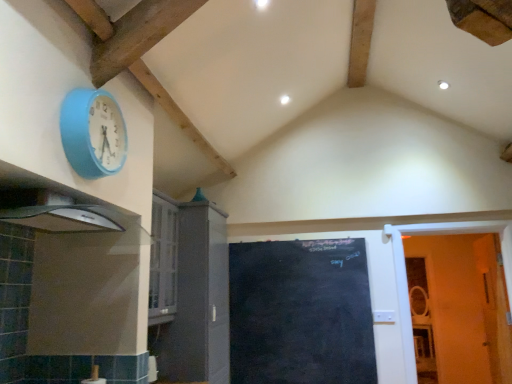
This screenshot has height=384, width=512. What do you see at coordinates (93, 133) in the screenshot? I see `blue rubber wall clock at upper left` at bounding box center [93, 133].

Where is `blue rubber wall clock at upper left`? The height and width of the screenshot is (384, 512). blue rubber wall clock at upper left is located at coordinates (93, 133).

Locate an element on the screen. Image resolution: width=512 pixels, height=384 pixels. white wooden door at right, acting as the second door starting from the left is located at coordinates (406, 275).

Identify the location of matte gray cabinet at center-left. (193, 293).

Locate an element on the screen. The width and height of the screenshot is (512, 384). black chalkboard at center, the 1th door from the left is located at coordinates (300, 313).

The width and height of the screenshot is (512, 384). Find the location of `blue rubber wall clock at upper left`. blue rubber wall clock at upper left is located at coordinates (x=93, y=133).

Considering the positions of objects black chalkboard at center, the 1th door from the left, and matte gray cabinet at center-left in the image provided, who is more to the right, black chalkboard at center, the 1th door from the left, or matte gray cabinet at center-left?

black chalkboard at center, the 1th door from the left.

Considering the sizes of black chalkboard at center, the 1th door from the left, and matte gray cabinet at center-left in the image, is black chalkboard at center, the 1th door from the left, bigger or smaller than matte gray cabinet at center-left?

black chalkboard at center, the 1th door from the left, is smaller than matte gray cabinet at center-left.

Considering their positions, is black chalkboard at center, positioned as the second door in right-to-left order, located in front of or behind matte gray cabinet at center-left?

Clearly, black chalkboard at center, positioned as the second door in right-to-left order, is behind matte gray cabinet at center-left.

From a real-world perspective, does black chalkboard at center, the 1th door from the left, sit lower than matte gray cabinet at center-left?

Indeed, from a real-world perspective, black chalkboard at center, the 1th door from the left, is positioned beneath matte gray cabinet at center-left.

Considering the sizes of objects blue rubber wall clock at upper left and white wooden door at right, acting as the second door starting from the left, in the image provided, who is thinner, blue rubber wall clock at upper left or white wooden door at right, acting as the second door starting from the left,?

Thinner between the two is blue rubber wall clock at upper left.

Is blue rubber wall clock at upper left not near white wooden door at right, acting as the second door starting from the left?

Indeed, blue rubber wall clock at upper left is not near white wooden door at right, acting as the second door starting from the left.

Measure the distance from blue rubber wall clock at upper left to white wooden door at right, acting as the second door starting from the left.

The distance of blue rubber wall clock at upper left from white wooden door at right, acting as the second door starting from the left, is 9.09 feet.

Would you say black chalkboard at center, positioned as the second door in right-to-left order, is part of matte gray cabinet at center-left's contents?

No, black chalkboard at center, positioned as the second door in right-to-left order, is not inside matte gray cabinet at center-left.

I want to click on door that is the 1st object to the right of the matte gray cabinet at center-left, starting at the anchor, so click(300, 313).

From the image's perspective, between matte gray cabinet at center-left and black chalkboard at center, the 1th door from the left, who is located below?

black chalkboard at center, the 1th door from the left, is shown below in the image.

Does matte gray cabinet at center-left turn towards white wooden door at right, which is the 1th door from right to left?

Yes.

Does matte gray cabinet at center-left have a lesser width compared to white wooden door at right, which is the 1th door from right to left?

Incorrect, the width of matte gray cabinet at center-left is not less than that of white wooden door at right, which is the 1th door from right to left.

Does matte gray cabinet at center-left have a greater height compared to white wooden door at right, which is the 1th door from right to left?

Yes, matte gray cabinet at center-left is taller than white wooden door at right, which is the 1th door from right to left.

Is black chalkboard at center, positioned as the second door in right-to-left order, positioned beyond the bounds of blue rubber wall clock at upper left?

black chalkboard at center, positioned as the second door in right-to-left order, lies outside blue rubber wall clock at upper left's area.

In the scene shown: Who is smaller, black chalkboard at center, positioned as the second door in right-to-left order, or blue rubber wall clock at upper left?

blue rubber wall clock at upper left.

Does black chalkboard at center, positioned as the second door in right-to-left order, have a greater width compared to blue rubber wall clock at upper left?

In fact, black chalkboard at center, positioned as the second door in right-to-left order, might be narrower than blue rubber wall clock at upper left.

Looking at this image, is black chalkboard at center, the 1th door from the left, placed right next to blue rubber wall clock at upper left?

There is a gap between black chalkboard at center, the 1th door from the left, and blue rubber wall clock at upper left.

Is blue rubber wall clock at upper left inside white wooden door at right, acting as the second door starting from the left?

No, blue rubber wall clock at upper left is not a part of white wooden door at right, acting as the second door starting from the left.

What's the angular difference between white wooden door at right, which is the 1th door from right to left, and blue rubber wall clock at upper left's facing directions?

The angular difference between white wooden door at right, which is the 1th door from right to left, and blue rubber wall clock at upper left is 90.6 degrees.

Considering the positions of objects white wooden door at right, which is the 1th door from right to left, and blue rubber wall clock at upper left in the image provided, who is more to the left, white wooden door at right, which is the 1th door from right to left, or blue rubber wall clock at upper left?

blue rubber wall clock at upper left.

From the image's perspective, is white wooden door at right, acting as the second door starting from the left, above blue rubber wall clock at upper left?

Actually, white wooden door at right, acting as the second door starting from the left, appears below blue rubber wall clock at upper left in the image.

Which object is thinner, white wooden door at right, which is the 1th door from right to left, or matte gray cabinet at center-left?

white wooden door at right, which is the 1th door from right to left.

Could you tell me if white wooden door at right, acting as the second door starting from the left, is turned towards matte gray cabinet at center-left?

No, white wooden door at right, acting as the second door starting from the left, does not turn towards matte gray cabinet at center-left.

Is white wooden door at right, which is the 1th door from right to left, completely or partially outside of matte gray cabinet at center-left?

Yes, white wooden door at right, which is the 1th door from right to left, is outside of matte gray cabinet at center-left.

Measure the distance from white wooden door at right, which is the 1th door from right to left, to matte gray cabinet at center-left.

white wooden door at right, which is the 1th door from right to left, and matte gray cabinet at center-left are 5.62 feet apart from each other.

Starting from the matte gray cabinet at center-left, which door is the 1st one to the right? Please provide its 2D coordinates.

[(300, 313)]

The width and height of the screenshot is (512, 384). I want to click on wall clock above the white wooden door at right, acting as the second door starting from the left (from a real-world perspective), so click(93, 133).

When comparing their distances from blue rubber wall clock at upper left, does matte gray cabinet at center-left or white wooden door at right, acting as the second door starting from the left, seem closer?

matte gray cabinet at center-left is closer to blue rubber wall clock at upper left.

From the image, which object appears to be farther from blue rubber wall clock at upper left, white wooden door at right, acting as the second door starting from the left, or matte gray cabinet at center-left?

white wooden door at right, acting as the second door starting from the left.

Looking at the image, which one is located closer to matte gray cabinet at center-left, black chalkboard at center, positioned as the second door in right-to-left order, or white wooden door at right, which is the 1th door from right to left?

black chalkboard at center, positioned as the second door in right-to-left order.

Which object lies nearer to the anchor point matte gray cabinet at center-left, blue rubber wall clock at upper left or black chalkboard at center, the 1th door from the left?

The object closer to matte gray cabinet at center-left is black chalkboard at center, the 1th door from the left.

Considering their positions, is blue rubber wall clock at upper left positioned closer to white wooden door at right, acting as the second door starting from the left, than matte gray cabinet at center-left?

matte gray cabinet at center-left is positioned closer to the anchor white wooden door at right, acting as the second door starting from the left.

Which object lies further to the anchor point black chalkboard at center, the 1th door from the left, matte gray cabinet at center-left or white wooden door at right, acting as the second door starting from the left?

white wooden door at right, acting as the second door starting from the left, lies further to black chalkboard at center, the 1th door from the left, than the other object.

From the image, which object appears to be farther from blue rubber wall clock at upper left, black chalkboard at center, positioned as the second door in right-to-left order, or matte gray cabinet at center-left?

The object further to blue rubber wall clock at upper left is black chalkboard at center, positioned as the second door in right-to-left order.

When comparing their distances from black chalkboard at center, the 1th door from the left, does matte gray cabinet at center-left or blue rubber wall clock at upper left seem further?

blue rubber wall clock at upper left.

Locate an element on the screen. Image resolution: width=512 pixels, height=384 pixels. door located between blue rubber wall clock at upper left and white wooden door at right, acting as the second door starting from the left, in the left-right direction is located at coordinates (300, 313).

Find the location of a particular element. cabinetry between blue rubber wall clock at upper left and white wooden door at right, which is the 1th door from right to left, in the horizontal direction is located at coordinates (193, 293).

At what (x,y) coordinates should I click in order to perform the action: click on cabinetry positioned between blue rubber wall clock at upper left and black chalkboard at center, the 1th door from the left, from near to far. Please return your answer as a coordinate pair (x, y). The image size is (512, 384). Looking at the image, I should click on (193, 293).

This screenshot has height=384, width=512. I want to click on door situated between matte gray cabinet at center-left and white wooden door at right, acting as the second door starting from the left, from left to right, so click(x=300, y=313).